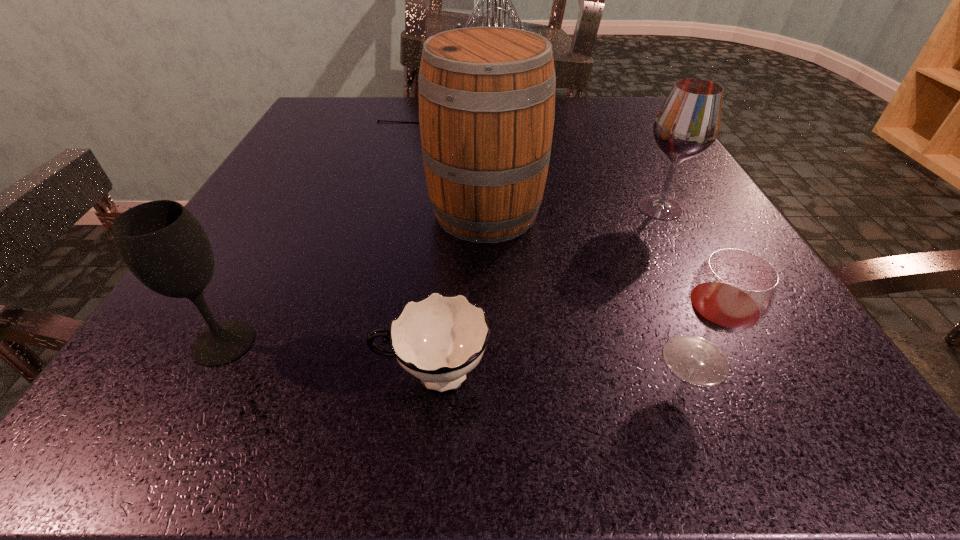
At what (x,y) coordinates should I click in order to perform the action: click on the farthest object. Please return your answer as a coordinate pair (x, y). Image resolution: width=960 pixels, height=540 pixels. Looking at the image, I should click on (495, 20).

You are a GUI agent. You are given a task and a screenshot of the screen. Output one action in this format:
    pyautogui.click(x=<x>, y=<y>)
    Task: Click on the cider
    
    Given the screenshot: What is the action you would take?
    pyautogui.click(x=486, y=94)

This screenshot has width=960, height=540. I want to click on the farthest wineglass, so click(688, 123).

You are a GUI agent. You are given a task and a screenshot of the screen. Output one action in this format:
    pyautogui.click(x=<x>, y=<y>)
    Task: Click on the leftmost object
    
    Given the screenshot: What is the action you would take?
    pyautogui.click(x=165, y=247)

Where is `the second shortest object`? the second shortest object is located at coordinates (733, 290).

The image size is (960, 540). In order to click on cup in this screenshot , I will do `click(439, 339)`.

In order to click on free region located on the front-facing side of the fan in this screenshot , I will do `click(592, 116)`.

Identify the location of vacant space situated on the right of the cider. (677, 213).

What are the coordinates of `vacant space located on the left of the farthest wineglass` in the screenshot? It's located at (532, 207).

Find the location of a particular element. This screenshot has width=960, height=540. vacant point located on the right of the leftmost object is located at coordinates (346, 342).